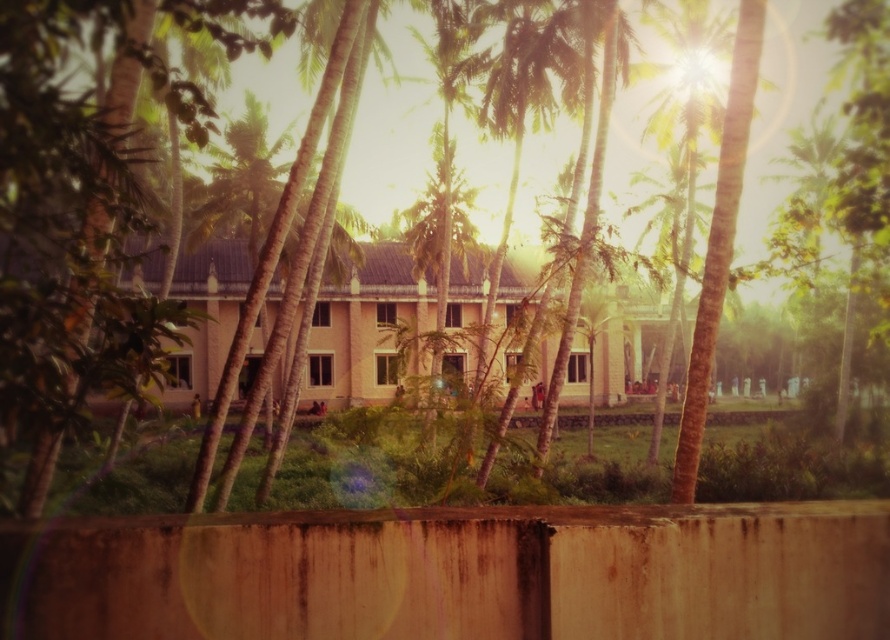
Is rusty concrete fence at lower center taller than green leafy palm tree at center?

No.

Who is shorter, rusty concrete fence at lower center or green leafy palm tree at center?

Standing shorter between the two is rusty concrete fence at lower center.

This screenshot has height=640, width=890. Identify the location of rusty concrete fence at lower center. (457, 573).